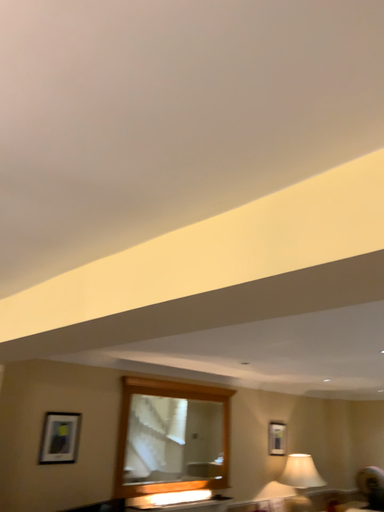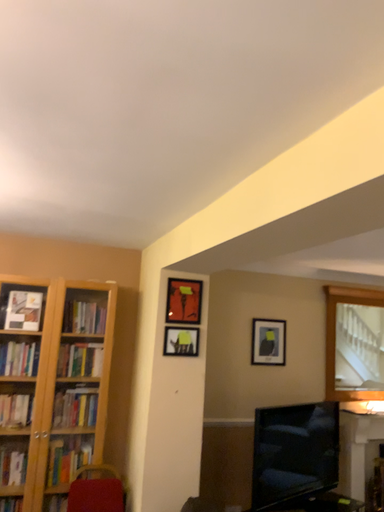
Question: How did the camera likely rotate when shooting the video?

Choices:
 (A) rotated right
 (B) rotated left

Answer: (B)